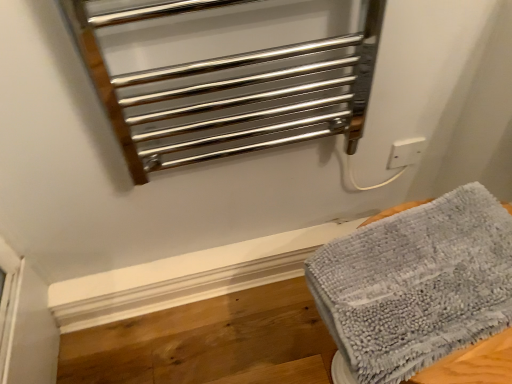
Question: Is white plastic electric outlet at upper right to the left of polished metal towel rack at upper center from the viewer's perspective?

Choices:
 (A) no
 (B) yes

Answer: (A)

Question: Can you confirm if white plastic electric outlet at upper right is wider than polished metal towel rack at upper center?

Choices:
 (A) yes
 (B) no

Answer: (B)

Question: Is white plastic electric outlet at upper right in front of polished metal towel rack at upper center?

Choices:
 (A) yes
 (B) no

Answer: (B)

Question: Is white plastic electric outlet at upper right to the right of polished metal towel rack at upper center from the viewer's perspective?

Choices:
 (A) yes
 (B) no

Answer: (A)

Question: Considering the relative sizes of white plastic electric outlet at upper right and polished metal towel rack at upper center in the image provided, is white plastic electric outlet at upper right smaller than polished metal towel rack at upper center?

Choices:
 (A) yes
 (B) no

Answer: (A)

Question: Would you say white plastic electric outlet at upper right contains polished metal towel rack at upper center?

Choices:
 (A) no
 (B) yes

Answer: (A)

Question: Considering the relative sizes of white plastic electric outlet at upper right and gray fluffy towel at lower right in the image provided, is white plastic electric outlet at upper right taller than gray fluffy towel at lower right?

Choices:
 (A) no
 (B) yes

Answer: (A)

Question: From a real-world perspective, is white plastic electric outlet at upper right beneath gray fluffy towel at lower right?

Choices:
 (A) no
 (B) yes

Answer: (B)

Question: Is white plastic electric outlet at upper right to the right of gray fluffy towel at lower right from the viewer's perspective?

Choices:
 (A) no
 (B) yes

Answer: (B)

Question: Does white plastic electric outlet at upper right lie in front of gray fluffy towel at lower right?

Choices:
 (A) yes
 (B) no

Answer: (B)

Question: Considering the relative sizes of white plastic electric outlet at upper right and gray fluffy towel at lower right in the image provided, is white plastic electric outlet at upper right smaller than gray fluffy towel at lower right?

Choices:
 (A) no
 (B) yes

Answer: (B)

Question: Are white plastic electric outlet at upper right and gray fluffy towel at lower right beside each other?

Choices:
 (A) no
 (B) yes

Answer: (A)

Question: Could white plastic electric outlet at upper right be considered to be inside gray fluffy towel at lower right?

Choices:
 (A) no
 (B) yes

Answer: (A)